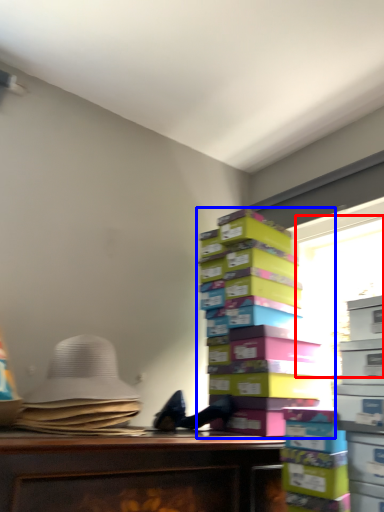
Question: Which object appears closest to the camera in this image, window screen (highlighted by a red box) or book (highlighted by a blue box)?

Choices:
 (A) window screen
 (B) book

Answer: (B)